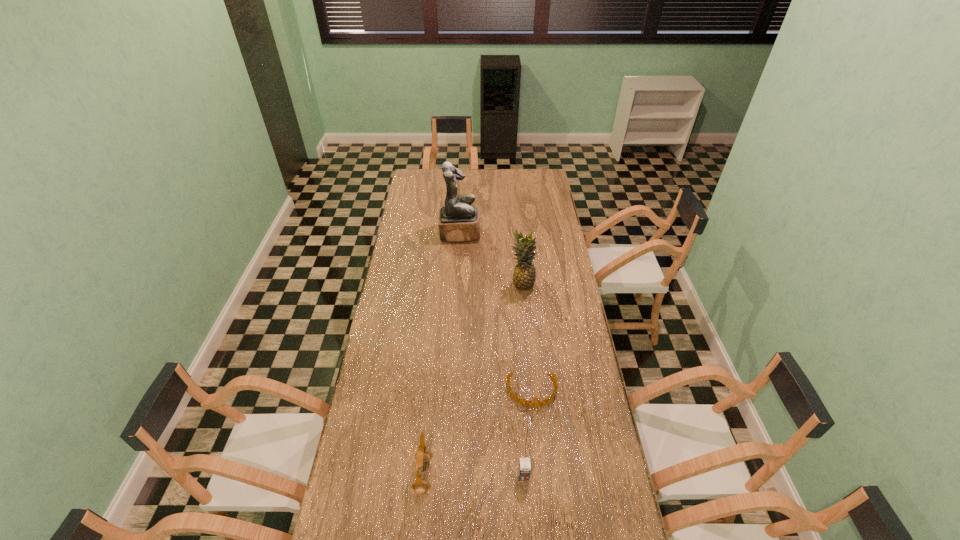
Find the location of a particular element. The image size is (960, 540). vacant space that's between the second shortest object and the third tallest object is located at coordinates (473, 475).

Find the location of `empty space between the third shortest object and the third nearest object`. empty space between the third shortest object and the third nearest object is located at coordinates (477, 433).

Where is `vacant space in between the earphone and the tiara`? This screenshot has height=540, width=960. vacant space in between the earphone and the tiara is located at coordinates (477, 433).

What are the coordinates of `unoccupied area between the tallest object and the shortest object` in the screenshot? It's located at (496, 312).

You are a GUI agent. You are given a task and a screenshot of the screen. Output one action in this format:
    pyautogui.click(x=<x>, y=<y>)
    Task: Click on the blank region between the earphone and the second tallest object
    The height and width of the screenshot is (540, 960).
    Given the screenshot: What is the action you would take?
    pyautogui.click(x=472, y=380)

Where is `empty space between the farthest object and the third shortest object`? The image size is (960, 540). empty space between the farthest object and the third shortest object is located at coordinates (442, 354).

Identify the location of empty location between the fourth tallest object and the fourth shortest object. (522, 380).

At what (x,y) coordinates should I click in order to perform the action: click on vacant area that lies between the chocolate milk and the fourth shortest object. Please return your answer as a coordinate pair (x, y). The width and height of the screenshot is (960, 540). Looking at the image, I should click on (522, 380).

Identify which object is the second closest to the third shortest object. Please provide its 2D coordinates. Your answer should be formatted as a tuple, i.e. [(x, y)], where the tuple contains the x and y coordinates of a point satisfying the conditions above.

[(547, 400)]

Identify which object is located as the nearest to the shortest object. Please provide its 2D coordinates. Your answer should be formatted as a tuple, i.e. [(x, y)], where the tuple contains the x and y coordinates of a point satisfying the conditions above.

[(524, 468)]